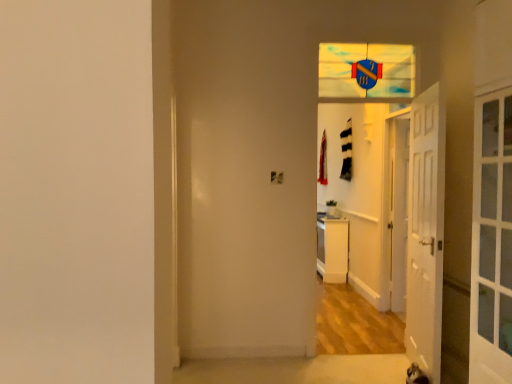
Question: Is stained glass shield at upper center closer to the viewer compared to white glossy door at center, the 1th door in the back-to-front sequence?

Choices:
 (A) no
 (B) yes

Answer: (B)

Question: Considering the relative sizes of stained glass shield at upper center and white glossy door at center, marked as the second door in a front-to-back arrangement, in the image provided, is stained glass shield at upper center smaller than white glossy door at center, marked as the second door in a front-to-back arrangement,?

Choices:
 (A) yes
 (B) no

Answer: (B)

Question: Is stained glass shield at upper center positioned behind white glossy door at center, the 1th door in the back-to-front sequence?

Choices:
 (A) no
 (B) yes

Answer: (A)

Question: Is stained glass shield at upper center oriented away from white glossy door at center, marked as the second door in a front-to-back arrangement?

Choices:
 (A) yes
 (B) no

Answer: (B)

Question: Would you say stained glass shield at upper center is outside white glossy door at center, marked as the second door in a front-to-back arrangement?

Choices:
 (A) yes
 (B) no

Answer: (A)

Question: Considering the positions of white wooden door at right, acting as the 1th door starting from the left, and stained glass shield at upper center in the image, is white wooden door at right, acting as the 1th door starting from the left, bigger or smaller than stained glass shield at upper center?

Choices:
 (A) big
 (B) small

Answer: (A)

Question: Considering the positions of point pos(433,200) and point pos(352,46), is point pos(433,200) closer or farther from the camera than point pos(352,46)?

Choices:
 (A) farther
 (B) closer

Answer: (B)

Question: From a real-world perspective, is white wooden door at right, which is the first door from front to back, positioned above or below stained glass shield at upper center?

Choices:
 (A) below
 (B) above

Answer: (A)

Question: From the image's perspective, is white wooden door at right, which is the first door from front to back, located above or below stained glass shield at upper center?

Choices:
 (A) below
 (B) above

Answer: (A)

Question: From a real-world perspective, is white glossy door at center, marked as the second door in a left-to-right arrangement, physically located above or below white glossy dresser at center?

Choices:
 (A) above
 (B) below

Answer: (A)

Question: Is white glossy door at center, marked as the second door in a front-to-back arrangement, inside the boundaries of white glossy dresser at center, or outside?

Choices:
 (A) inside
 (B) outside

Answer: (B)

Question: From the image's perspective, relative to white glossy dresser at center, is white glossy door at center, marked as the second door in a left-to-right arrangement, above or below?

Choices:
 (A) below
 (B) above

Answer: (B)

Question: Is point click(x=407, y=172) positioned closer to the camera than point click(x=340, y=271)?

Choices:
 (A) closer
 (B) farther

Answer: (A)

Question: In terms of width, does white glossy door at center, the 1th door in the back-to-front sequence, look wider or thinner when compared to stained glass shield at upper center?

Choices:
 (A) thin
 (B) wide

Answer: (A)

Question: Do you think white glossy door at center, which is counted as the first door, starting from the right, is within stained glass shield at upper center, or outside of it?

Choices:
 (A) inside
 (B) outside

Answer: (B)